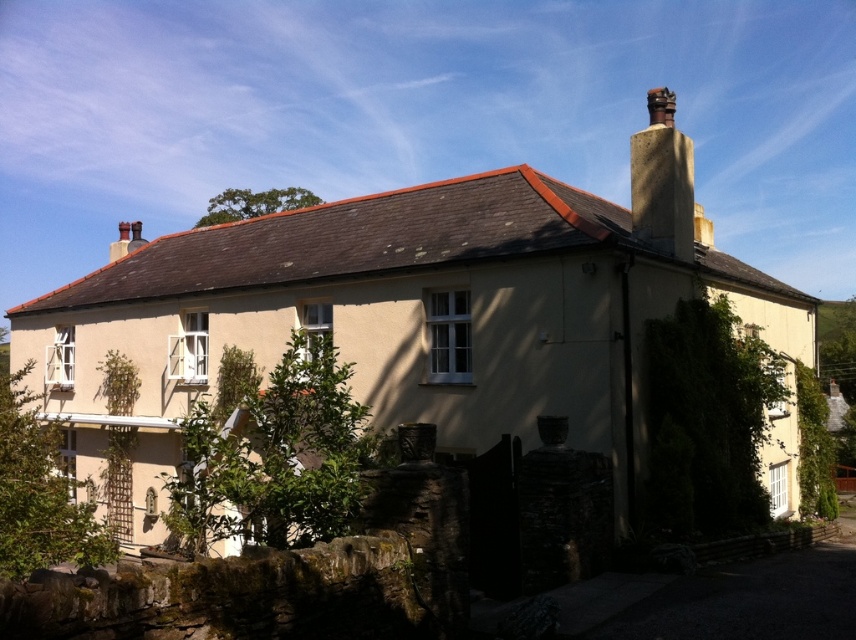
Question: Is beige stucco cottage at center positioned at the back of smooth stone chimney at upper right?

Choices:
 (A) no
 (B) yes

Answer: (A)

Question: Which point appears farthest from the camera in this image?

Choices:
 (A) (792, 401)
 (B) (666, 168)

Answer: (A)

Question: Does beige stucco cottage at center appear on the right side of smooth stone chimney at upper right?

Choices:
 (A) no
 (B) yes

Answer: (A)

Question: Can you confirm if beige stucco cottage at center is positioned above smooth stone chimney at upper right?

Choices:
 (A) no
 (B) yes

Answer: (A)

Question: Among these points, which one is farthest from the camera?

Choices:
 (A) [681, 250]
 (B) [345, 340]

Answer: (B)